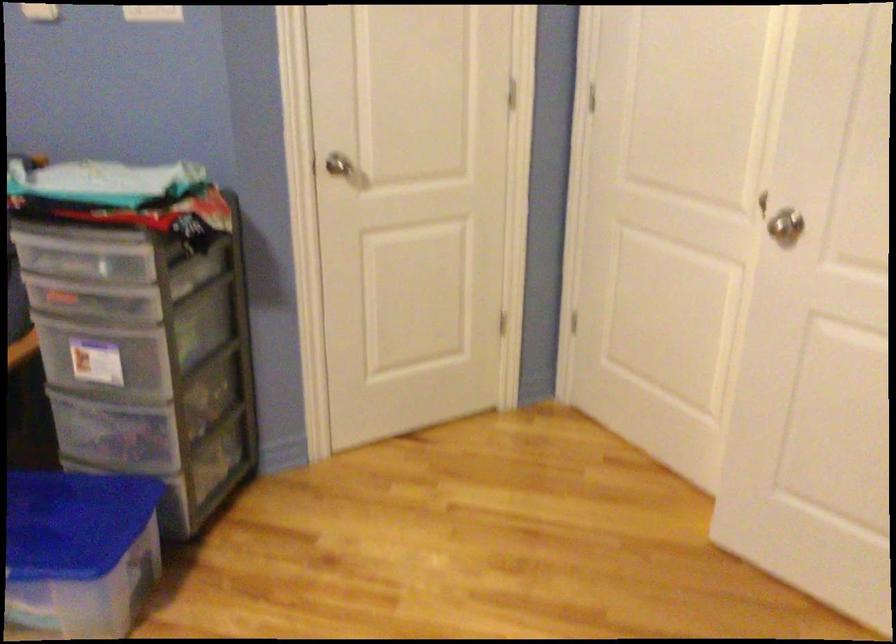
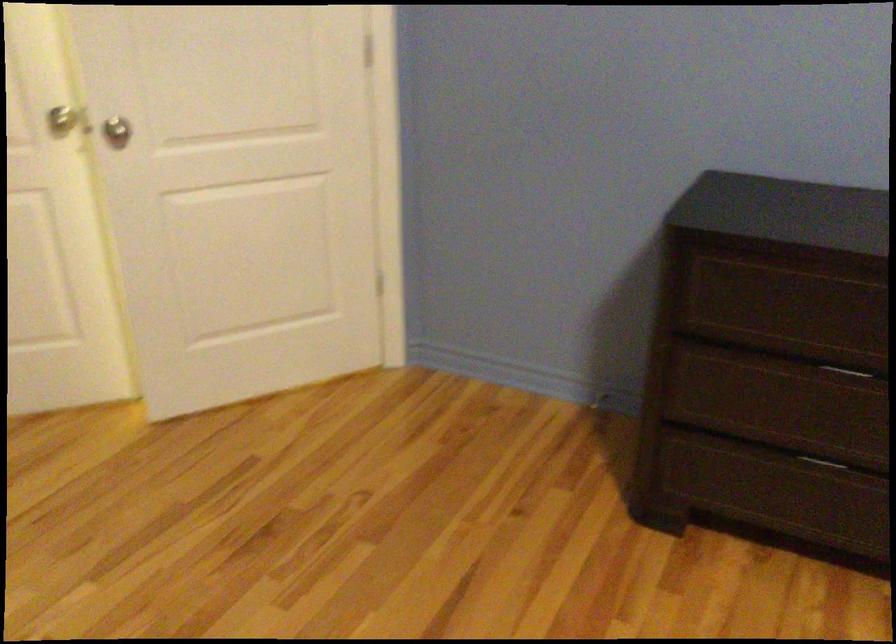
The point at (799, 222) is marked in the first image. Where is the corresponding point in the second image?

(116, 131)